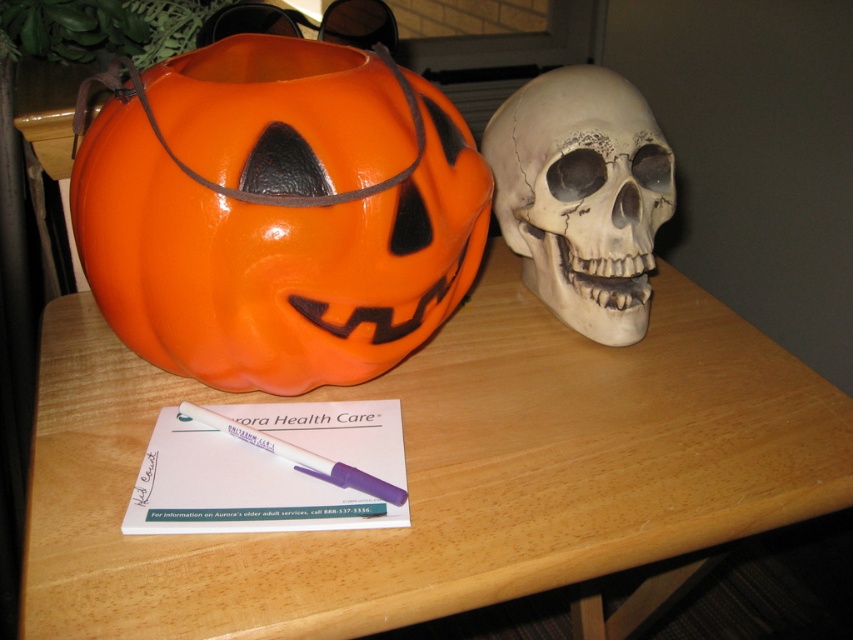
Is point (231, 280) farther from viewer compared to point (332, 483)?

That is False.

Does point (317, 292) come closer to viewer compared to point (323, 468)?

Yes, point (317, 292) is in front of point (323, 468).

Is point (314, 324) less distant than point (250, 442)?

Yes.

I want to click on glossy plastic pumpkin at left, so click(277, 212).

Can you confirm if wooden table at center is positioned above glossy plastic pumpkin at left?

Incorrect, wooden table at center is not positioned above glossy plastic pumpkin at left.

Which of these two, wooden table at center or glossy plastic pumpkin at left, stands shorter?

wooden table at center is shorter.

Which is in front, point (45, 632) or point (238, 145)?

Point (45, 632)

I want to click on wooden table at center, so click(440, 470).

Between white matte skull at right and purple plastic pen at center, which one is positioned higher?

white matte skull at right is higher up.

Is white matte skull at right further to the viewer compared to purple plastic pen at center?

Yes, it is.

The height and width of the screenshot is (640, 853). Describe the element at coordinates (582, 195) in the screenshot. I see `white matte skull at right` at that location.

I want to click on white matte skull at right, so click(x=582, y=195).